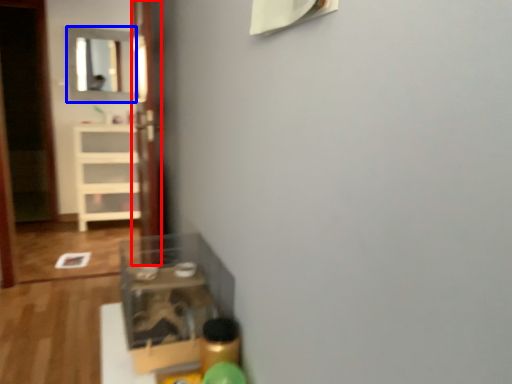
Question: Which object is further to the camera taking this photo, glass door (highlighted by a red box) or mirror (highlighted by a blue box)?

Choices:
 (A) glass door
 (B) mirror

Answer: (B)